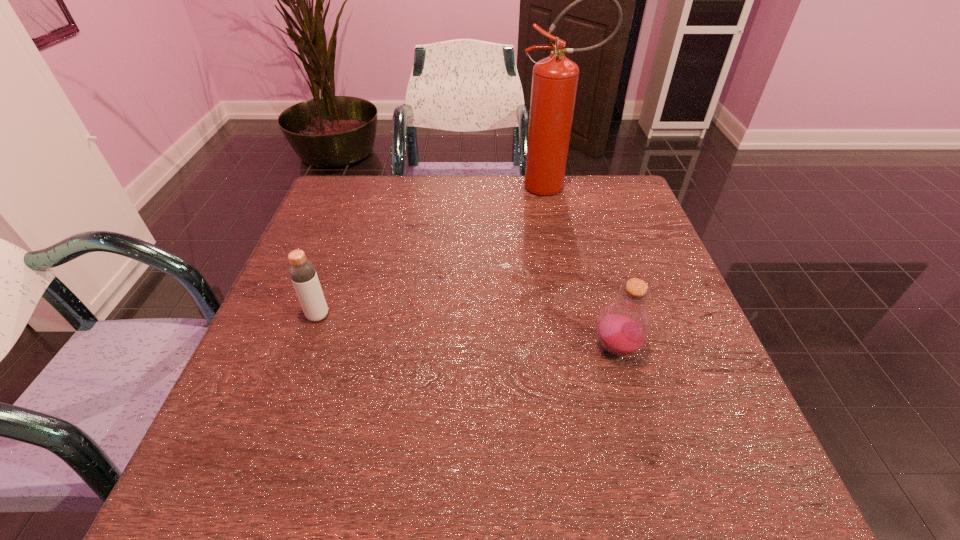
Image resolution: width=960 pixels, height=540 pixels. I want to click on free space that satisfies the following two spatial constraints: 1. on the back side of the nearer bottle; 2. from the nozzle of the tallest object, so click(571, 187).